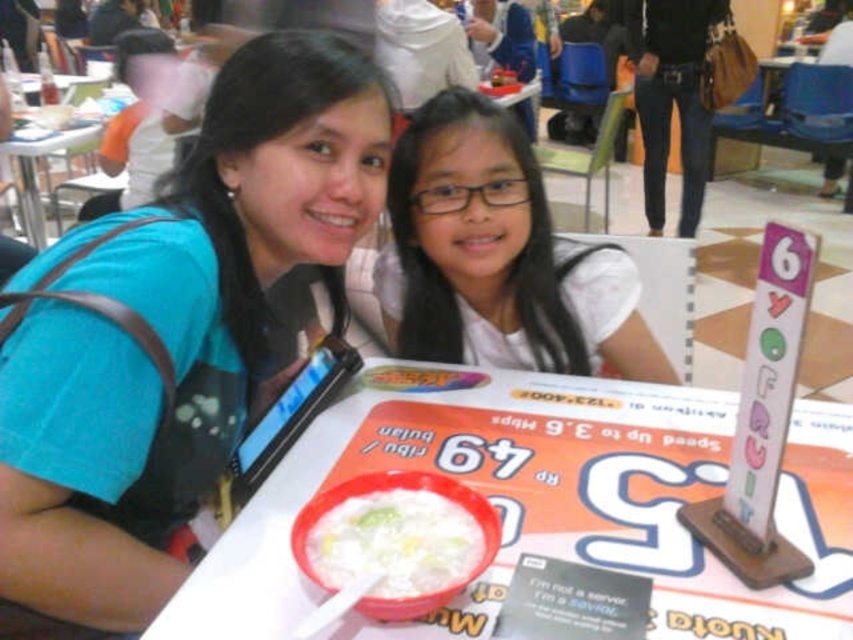
Can you confirm if white matte hair at center is bigger than white creamy porridge at center?

Indeed, white matte hair at center has a larger size compared to white creamy porridge at center.

In the scene shown: Is white matte hair at center positioned before white creamy porridge at center?

No, it is not.

At what (x,y) coordinates should I click in order to perform the action: click on white matte hair at center. Please return your answer as a coordinate pair (x, y). The height and width of the screenshot is (640, 853). Looking at the image, I should click on (496, 257).

The width and height of the screenshot is (853, 640). What are the coordinates of `white matte hair at center` in the screenshot? It's located at (496, 257).

Can you confirm if blue fabric shirt at upper left is taller than white paperboard at center?

Indeed, blue fabric shirt at upper left has a greater height compared to white paperboard at center.

Who is more distant from viewer, (113, 589) or (322, 465)?

Positioned behind is point (322, 465).

I want to click on blue fabric shirt at upper left, so click(x=177, y=326).

Who is shorter, white creamy porridge at center or white plastic table at upper left?

Standing shorter between the two is white creamy porridge at center.

Is white creamy porridge at center to the left of white plastic table at upper left from the viewer's perspective?

In fact, white creamy porridge at center is to the right of white plastic table at upper left.

Which is behind, point (440, 506) or point (20, 208)?

Positioned behind is point (20, 208).

At what (x,y) coordinates should I click in order to perform the action: click on white creamy porridge at center. Please return your answer as a coordinate pair (x, y). The image size is (853, 640). Looking at the image, I should click on (399, 541).